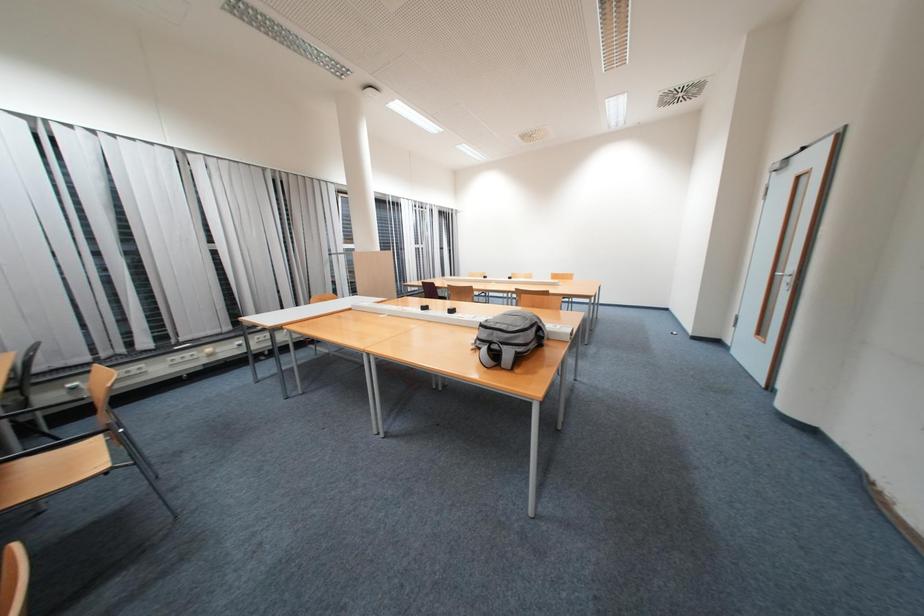
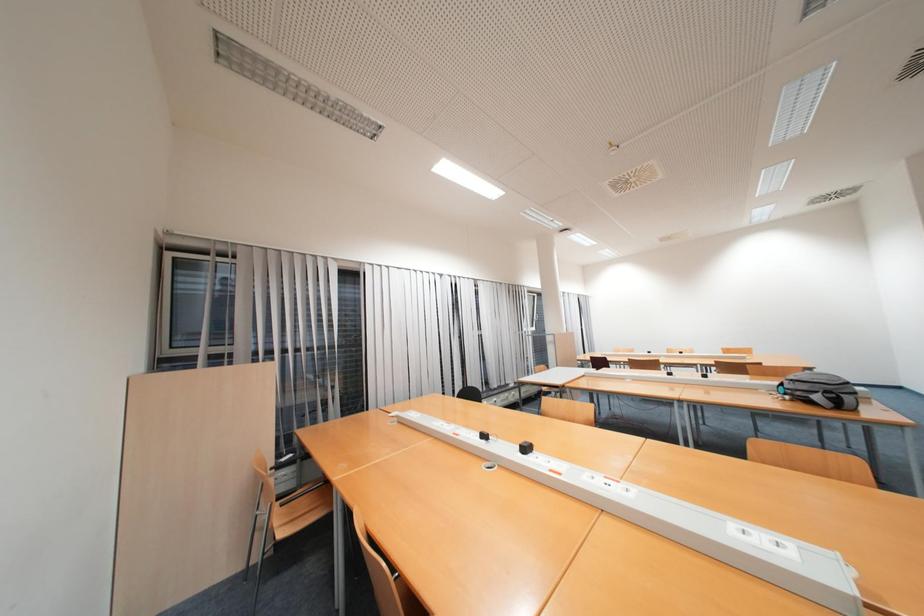
What movement of the cameraman would produce the second image?

The movement direction of the cameraman is left, backward.